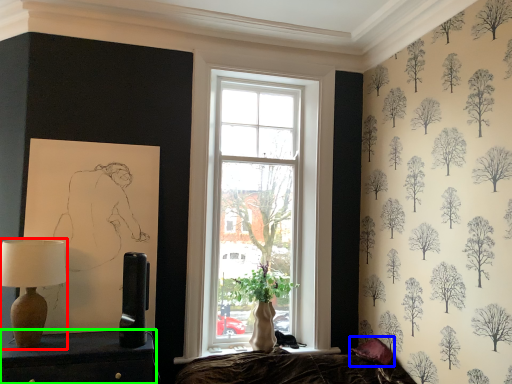
Question: Which object is the farthest from table lamp (highlighted by a red box)? Choose among these: pillow (highlighted by a blue box) or furniture (highlighted by a green box).

Choices:
 (A) pillow
 (B) furniture

Answer: (A)